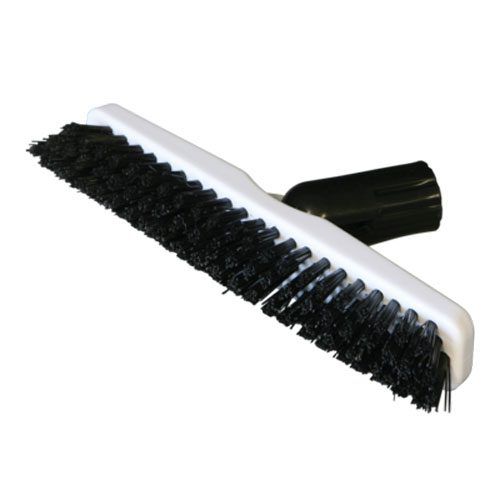
Locate an element on the screen. handle is located at coordinates (359, 195).